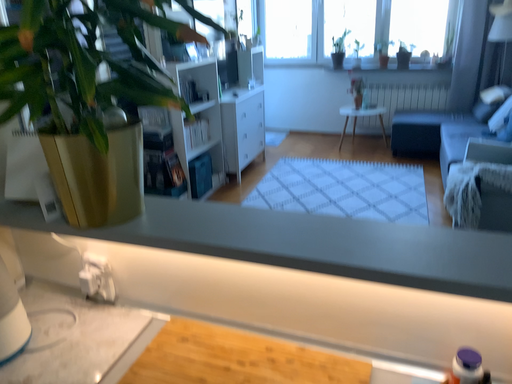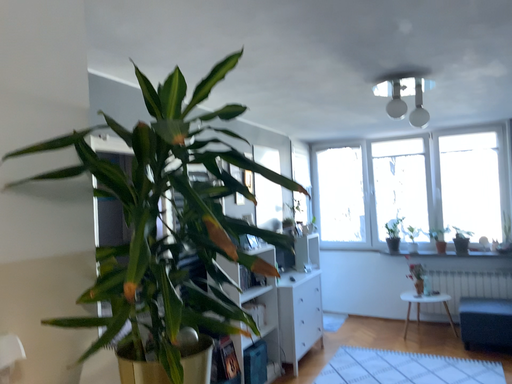
Question: How did the camera likely rotate when shooting the video?

Choices:
 (A) rotated upward
 (B) rotated downward

Answer: (A)